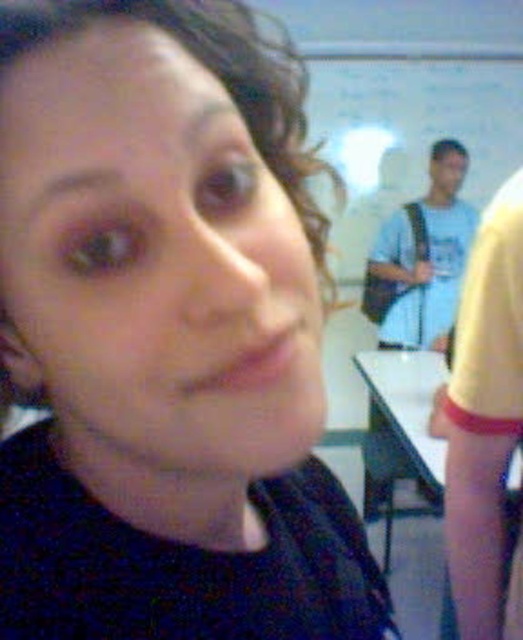
You are organizing a small event and need to place a 2ft by 2ft square decoration on either the yellow fabric at right or the white glossy table at lower right. Based on their sizes, which surface would be more suitable for the decoration?

The white glossy table at lower right is more suitable because it occupies more space than the yellow fabric at right, providing enough area for the 2ft by 2ft square decoration.

You are standing in the room and want to write on the whiteboard at upper center. Based on its position, where should you walk to reach it?

The whiteboard at upper center is located at point 0.209 on the x axis and 0.782 on the y axis, so you should walk towards the upper center area of the room to reach it.

You are standing in a classroom and want to write on the whiteboard at upper center. The whiteboard at upper center is located at point (408, 132). If you face the whiteboard at upper center, which direction should you move to reach it?

Since the whiteboard at upper center is located at point (408, 132), you should move forward towards the whiteboard at upper center to reach it.